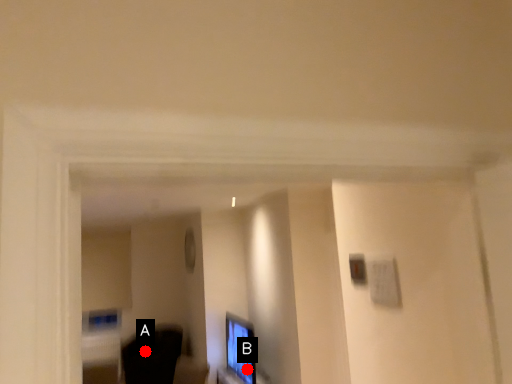
Question: Two points are circled on the image, labeled by A and B beside each circle. Which point is closer to the camera?

Choices:
 (A) A is closer
 (B) B is closer

Answer: (B)